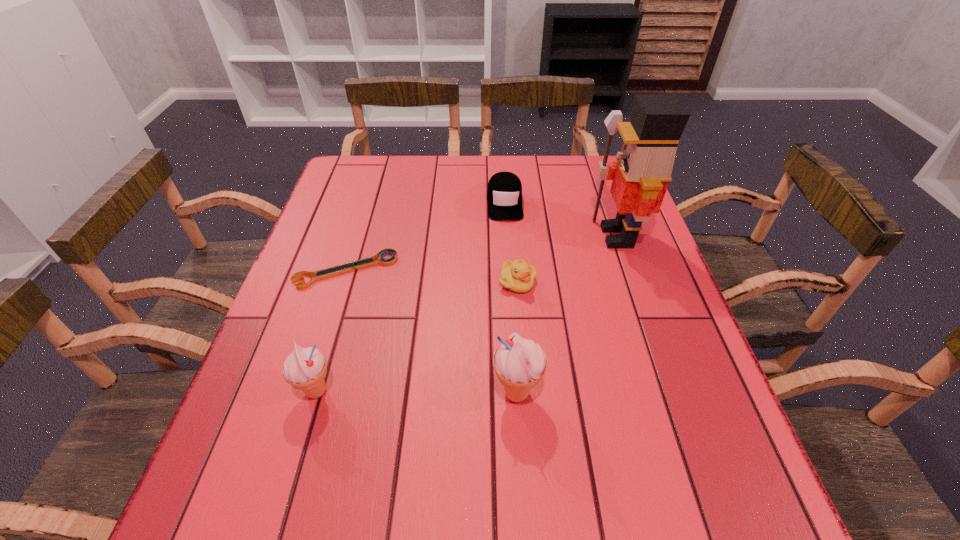
Where is `free space between the cap and the rightmost object`? The width and height of the screenshot is (960, 540). free space between the cap and the rightmost object is located at coordinates (561, 220).

You are a GUI agent. You are given a task and a screenshot of the screen. Output one action in this format:
    pyautogui.click(x=<x>, y=<y>)
    Task: Click on the empty space that is in between the shortest object and the cap
    The width and height of the screenshot is (960, 540).
    Given the screenshot: What is the action you would take?
    pyautogui.click(x=425, y=236)

Image resolution: width=960 pixels, height=540 pixels. I want to click on vacant space that's between the rightmost object and the cap, so click(561, 220).

Locate an element on the screen. This screenshot has width=960, height=540. vacant space that is in between the fourth shortest object and the tallest object is located at coordinates (467, 314).

Find the location of a particular element. Image resolution: width=960 pixels, height=540 pixels. free space between the duckling and the third tallest object is located at coordinates 417,337.

Locate an element on the screen. free area in between the duckling and the nutcracker is located at coordinates (566, 259).

At what (x,y) coordinates should I click in order to perform the action: click on free spot between the cap and the tallest object. Please return your answer as a coordinate pair (x, y). The height and width of the screenshot is (540, 960). Looking at the image, I should click on (561, 220).

Find the location of `vacant area between the tallest object and the shorter icecream`. vacant area between the tallest object and the shorter icecream is located at coordinates (467, 314).

This screenshot has height=540, width=960. What are the coordinates of `object that can be found as the third closest to the taller icecream` in the screenshot? It's located at (351, 266).

Identify which object is the second nearest to the duckling. Please provide its 2D coordinates. Your answer should be formatted as a tuple, i.e. [(x, y)], where the tuple contains the x and y coordinates of a point satisfying the conditions above.

[(504, 193)]